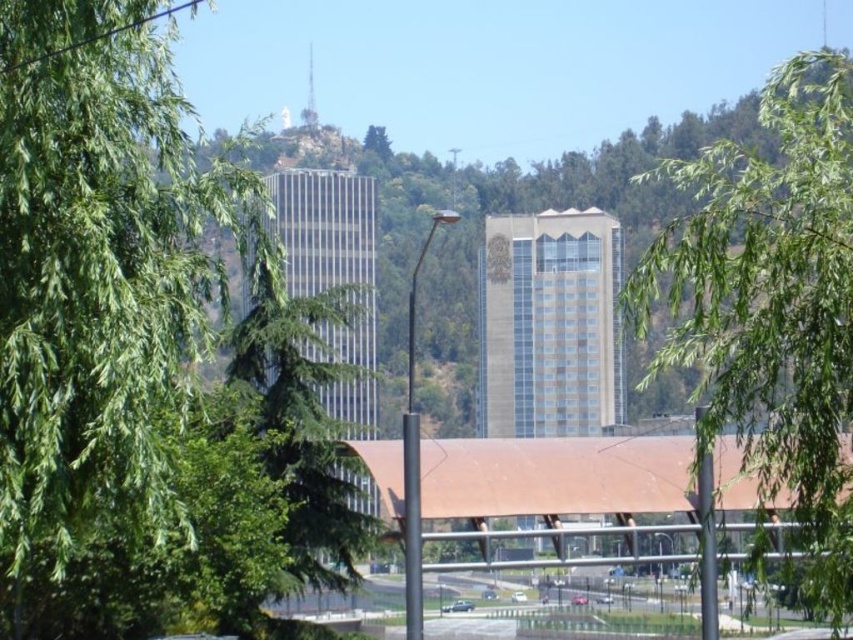
Can you confirm if green leafy tree at left is positioned below white glossy car at center?

No.

How distant is green leafy tree at left from white glossy car at center?

green leafy tree at left is 94.94 meters away from white glossy car at center.

Does point (18, 353) come in front of point (519, 600)?

Yes.

Locate an element on the screen. green leafy tree at left is located at coordinates (146, 355).

Can you confirm if green leafy tree at left is positioned below metallic silver car at center?

Actually, green leafy tree at left is above metallic silver car at center.

Can you confirm if green leafy tree at left is positioned to the right of metallic silver car at center?

No, green leafy tree at left is not to the right of metallic silver car at center.

Image resolution: width=853 pixels, height=640 pixels. I want to click on green leafy tree at left, so click(146, 355).

Locate an element on the screen. This screenshot has height=640, width=853. green leafy tree at left is located at coordinates (146, 355).

Who is more distant from viewer, (12, 604) or (804, 288)?

Point (12, 604)

Is green leafy tree at left shorter than green leafy tree at center?

No.

Is point (347, 314) farther from viewer compared to point (753, 220)?

That is True.

You are a GUI agent. You are given a task and a screenshot of the screen. Output one action in this format:
    pyautogui.click(x=<x>, y=<y>)
    Task: Click on the green leafy tree at left
    
    Given the screenshot: What is the action you would take?
    pyautogui.click(x=146, y=355)